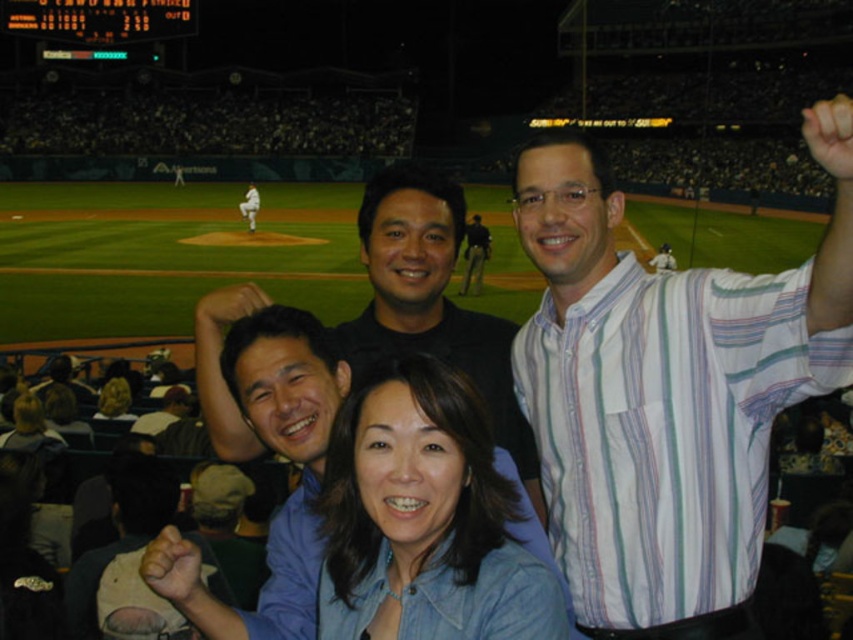
Question: Which is farther from the black matte shirt at center?

Choices:
 (A) denim shirt at lower center
 (B) white striped shirt at upper right
 (C) dark blue uniform at center
 (D) smooth brown hair at lower center

Answer: (C)

Question: Does denim shirt at lower center appear under smooth brown hair at lower center?

Choices:
 (A) no
 (B) yes

Answer: (B)

Question: Estimate the real-world distances between objects in this image. Which object is closer to the dark blue uniform at center?

Choices:
 (A) smooth brown hair at lower center
 (B) black matte shirt at center
 (C) white striped shirt at upper right

Answer: (A)

Question: Does white striped shirt at upper right have a larger size compared to white uniform at center?

Choices:
 (A) yes
 (B) no

Answer: (A)

Question: Which of the following is the farthest from the observer?

Choices:
 (A) (398, 195)
 (B) (242, 212)
 (C) (421, 381)

Answer: (B)

Question: Does white striped shirt at upper right come behind white uniform at center?

Choices:
 (A) no
 (B) yes

Answer: (A)